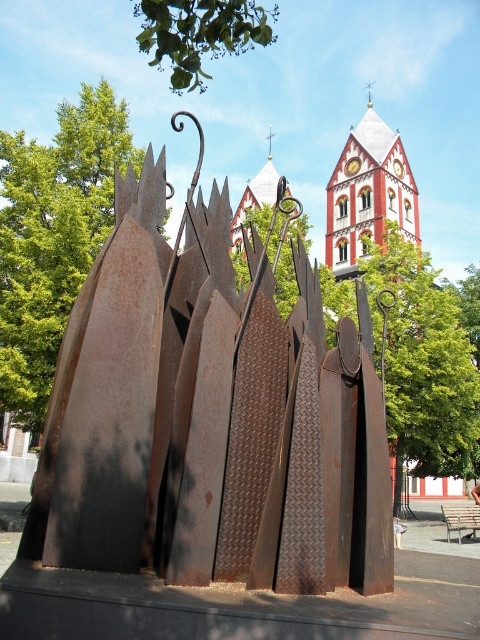
Question: Can you confirm if rusty metal sculpture at center is positioned to the left of brown wooden park bench at center?

Choices:
 (A) yes
 (B) no

Answer: (A)

Question: Does rusty metal sculpture at center have a larger size compared to brown wooden park bench at center?

Choices:
 (A) yes
 (B) no

Answer: (A)

Question: Among these points, which one is nearest to the camera?

Choices:
 (A) (454, 506)
 (B) (372, 451)

Answer: (B)

Question: Does rusty metal sculpture at center have a lesser width compared to brown wooden park bench at center?

Choices:
 (A) no
 (B) yes

Answer: (A)